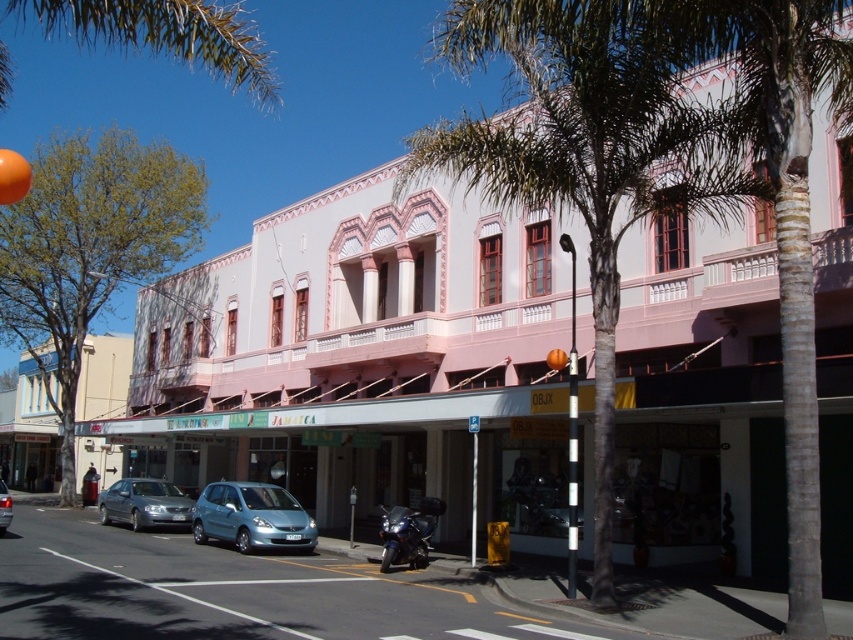
Question: Which point is farther to the camera?

Choices:
 (A) (164, 513)
 (B) (0, 509)
 (C) (635, 164)
 (D) (212, 486)

Answer: (A)

Question: Which object is the closest to the silver metallic hatchback at center?

Choices:
 (A) green leafy palm tree at center
 (B) green leafy palm tree at upper left

Answer: (A)

Question: Is green leafy palm tree at upper left positioned in front of silver metallic hatchback at center?

Choices:
 (A) yes
 (B) no

Answer: (A)

Question: Is green leafy palm tree at upper left thinner than silver metallic sedan at lower left?

Choices:
 (A) no
 (B) yes

Answer: (A)

Question: Observing the image, what is the correct spatial positioning of silver metallic sedan at lower left in reference to silver metallic hatchback at center?

Choices:
 (A) right
 (B) left

Answer: (A)

Question: Which point is closer to the camera taking this photo?

Choices:
 (A) (76, 16)
 (B) (107, 488)
 (C) (590, 26)
 (D) (6, 529)

Answer: (A)